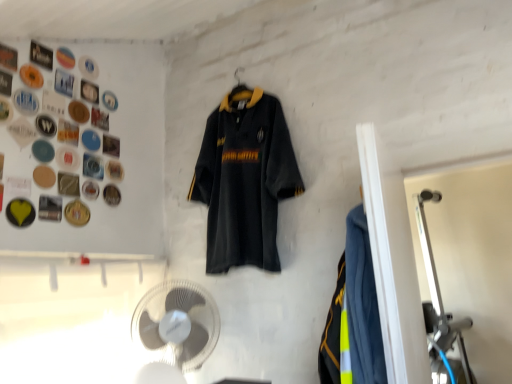
Question: Considering the positions of gold metallic button at upper left, the first button positioned from the bottom, and matte black button at upper left, positioned as the 8th button in top-to-bottom order, in the image, is gold metallic button at upper left, the first button positioned from the bottom, wider or thinner than matte black button at upper left, positioned as the 8th button in top-to-bottom order,?

Choices:
 (A) wide
 (B) thin

Answer: (B)

Question: Is gold metallic button at upper left, the first button positioned from the bottom, to the left or to the right of matte black button at upper left, the 6th button from the bottom, in the image?

Choices:
 (A) left
 (B) right

Answer: (B)

Question: Which of these objects is positioned farthest from the gold metallic button at upper left, the first button positioned from the bottom?

Choices:
 (A) metallic silver button at upper left, placed as the 11th button when sorted from bottom to top
 (B) neon yellow reflective vest at right
 (C) metallic silver button at upper left, which is counted as the 9th button, starting from the top
 (D) metallic silver button at upper left, arranged as the 7th button when ordered from the bottom
 (E) yellow matte button at upper left, which is the twelfth button from top to bottom

Answer: (B)

Question: Estimate the real-world distances between objects in this image. Which object is farther from the yellow matte button at upper left, which is the twelfth button from top to bottom?

Choices:
 (A) metallic silver button at upper left, arranged as the third button when viewed from the top
 (B) metallic button at upper left, which is the second button in top-to-bottom order
 (C) gold metallic button at upper left, which is the 13th button from top to bottom
 (D) metallic silver button at upper left, which is counted as the 9th button, starting from the top
 (E) metallic gold button at upper left, marked as the 11th button in a top-to-bottom arrangement

Answer: (B)